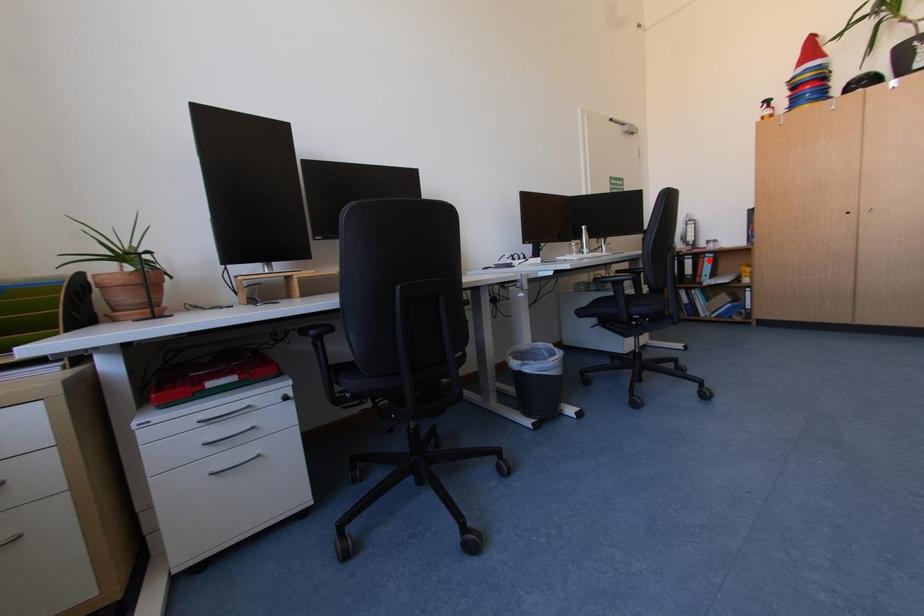
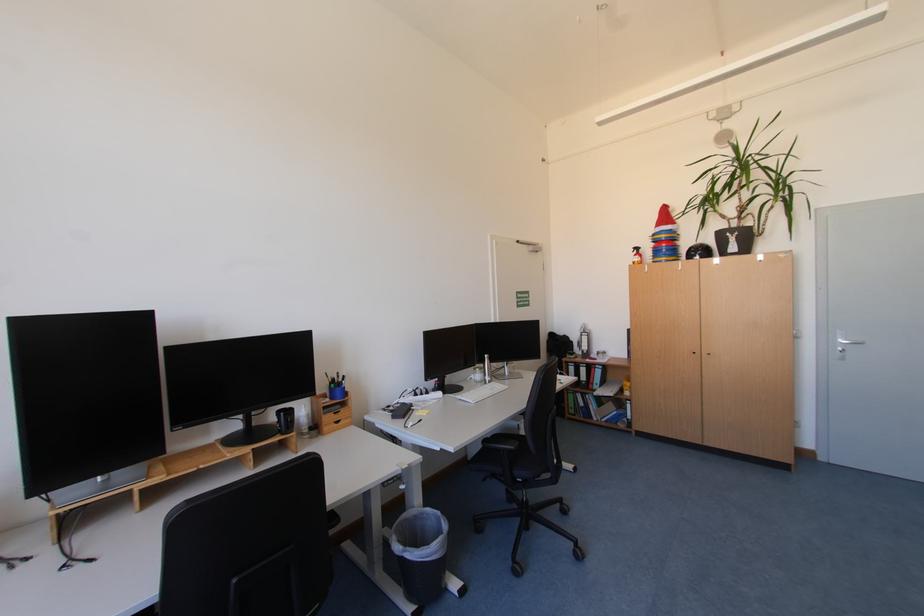
Locate, in the second image, the point that corresponds to the highlighted location in the first image.

(601, 370)